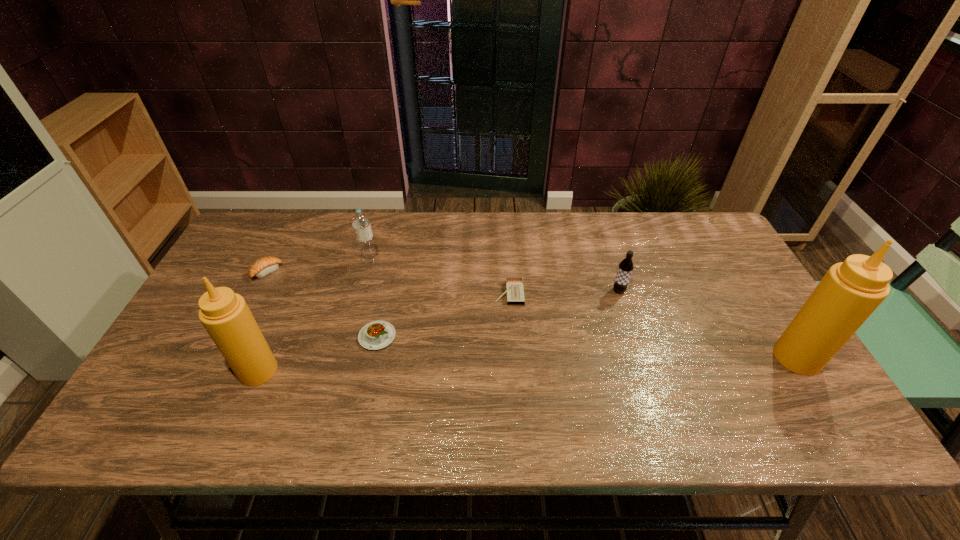
Find the location of a particular element. spot to insert another condiment for uniform distribution is located at coordinates (531, 364).